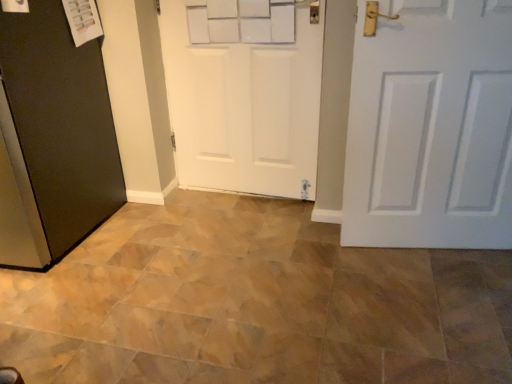
The height and width of the screenshot is (384, 512). Find the location of `vacant point to the left of white matte door at center, the first door positioned from the right`. vacant point to the left of white matte door at center, the first door positioned from the right is located at coordinates (325, 263).